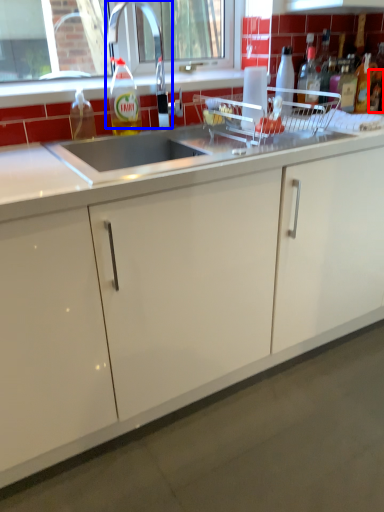
Question: Which object is closer to the camera taking this photo, bottle (highlighted by a red box) or faucet (highlighted by a blue box)?

Choices:
 (A) bottle
 (B) faucet

Answer: (B)